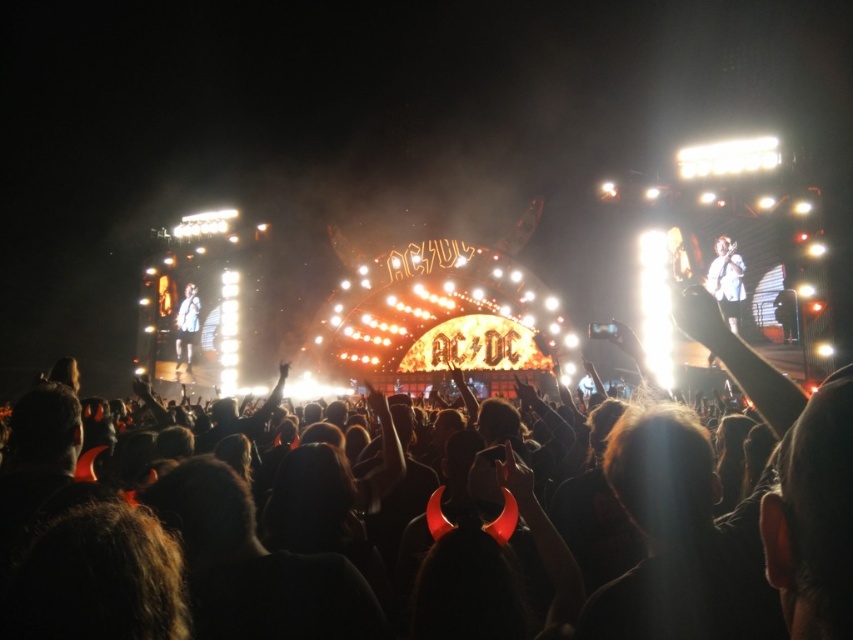
You are a photographer at the concert and want to capture both the white fabric shirt at upper right and the white fabric shirt at left in a single frame. Which shirt should you focus on to ensure both are visible without moving the camera?

You should focus on the white fabric shirt at left because the white fabric shirt at upper right is shorter than it, ensuring both can be captured in the frame.

You are a photographer at the concert and want to capture both the white fabric shirt at upper right and the white fabric shirt at left in a single shot. Which shirt should you focus on first to ensure both are in clear view?

You should focus on the white fabric shirt at upper right first because it is closer to the viewer, ensuring both shirts will be in focus when using a proper depth of field.